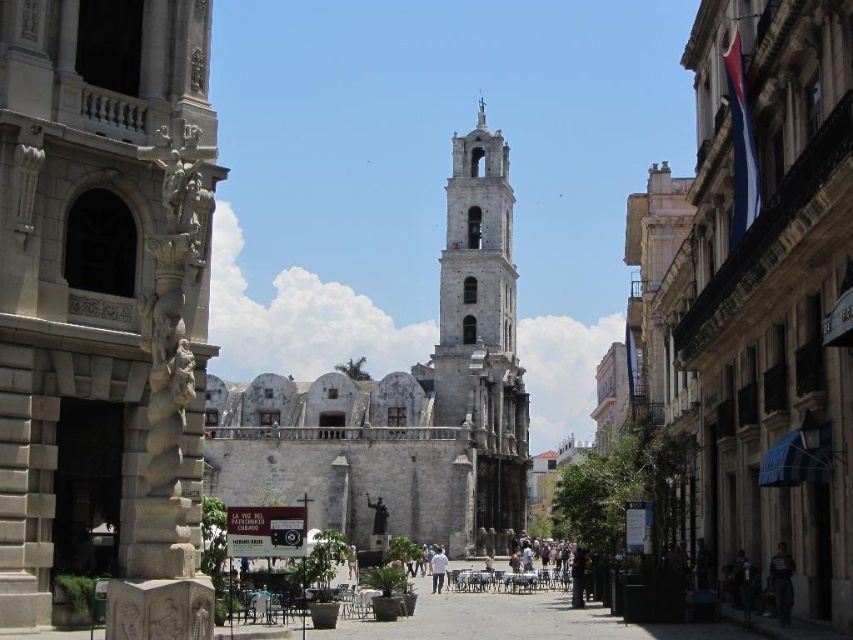
Is white stone bell tower at center below light brown wooden statue at center?

No.

From the picture: Does white stone bell tower at center have a greater height compared to light brown wooden statue at center?

Correct, white stone bell tower at center is much taller as light brown wooden statue at center.

Does point (468, 288) lie in front of point (350, 579)?

No, (468, 288) is further to viewer.

This screenshot has width=853, height=640. I want to click on white stone bell tower at center, so click(x=476, y=280).

Which is more to the right, dark gray fabric jacket at lower right or light brown wooden statue at center?

dark gray fabric jacket at lower right

Does dark gray fabric jacket at lower right have a lesser width compared to light brown wooden statue at center?

Correct, dark gray fabric jacket at lower right's width is less than light brown wooden statue at center's.

Which is behind, point (776, 595) or point (357, 557)?

The point (357, 557) is behind.

You are a GUI agent. You are given a task and a screenshot of the screen. Output one action in this format:
    pyautogui.click(x=<x>, y=<y>)
    Task: Click on the dark gray fabric jacket at lower right
    The image size is (853, 640).
    Given the screenshot: What is the action you would take?
    pyautogui.click(x=781, y=582)

Measure the distance from bronze statue at center to light brown wooden statue at center.

They are 48.35 feet apart.

Between point (381, 522) and point (351, 547), which one is positioned in front?

Point (351, 547) is more forward.

Find the location of `bronze statue at center`. bronze statue at center is located at coordinates (378, 515).